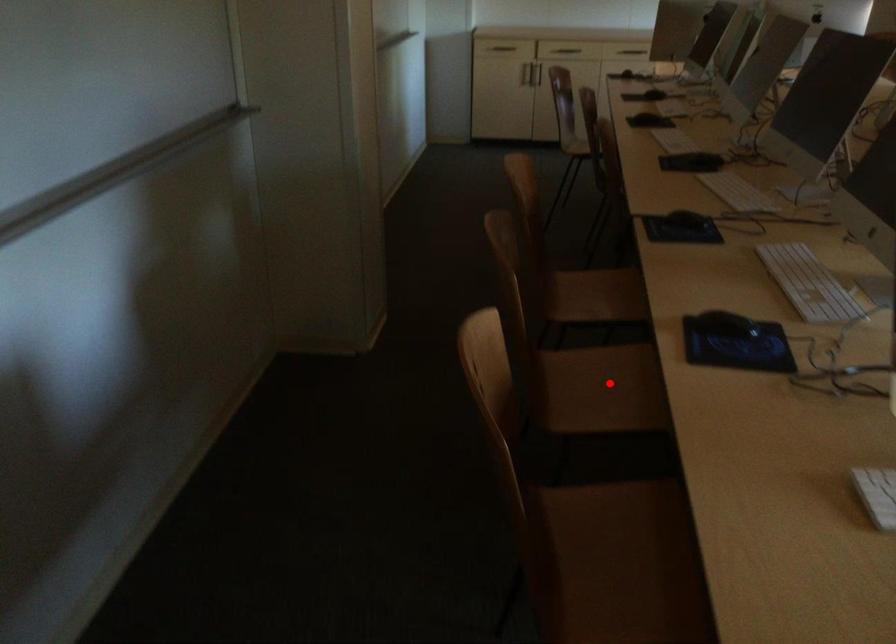
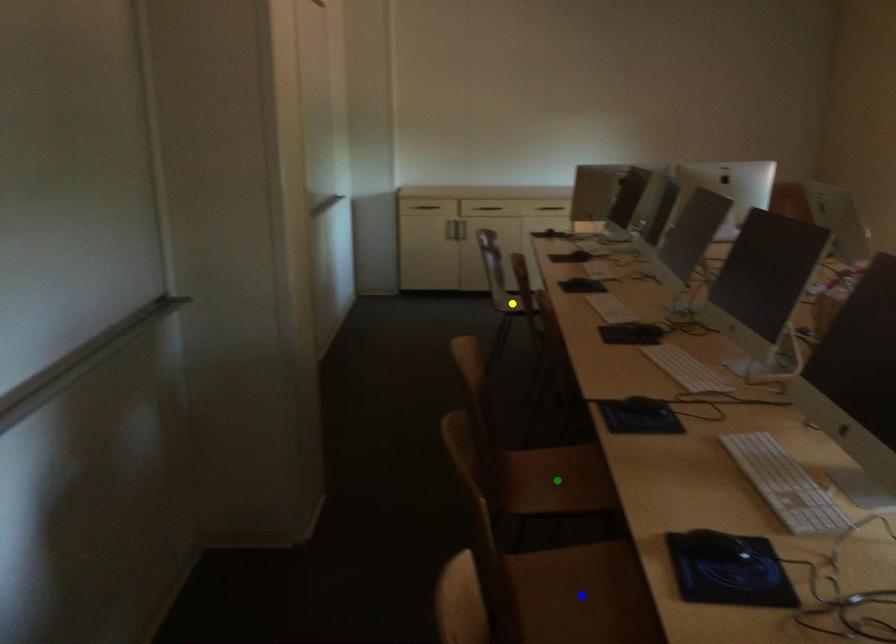
Question: I am providing you with two images of the same scene from different viewpoints. A red point is marked on the first image. You are given multiple points on the second image. Which point in image 2 represents the same 3d spot as the red point in image 1?

Choices:
 (A) yellow point
 (B) green point
 (C) blue point

Answer: (C)